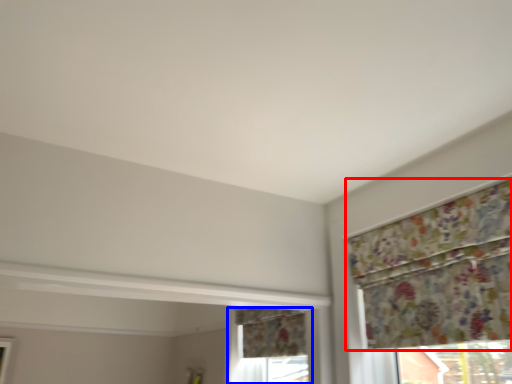
Question: Which of the following is the closest to the observer, curtain (highlighted by a red box) or window (highlighted by a blue box)?

Choices:
 (A) curtain
 (B) window

Answer: (A)